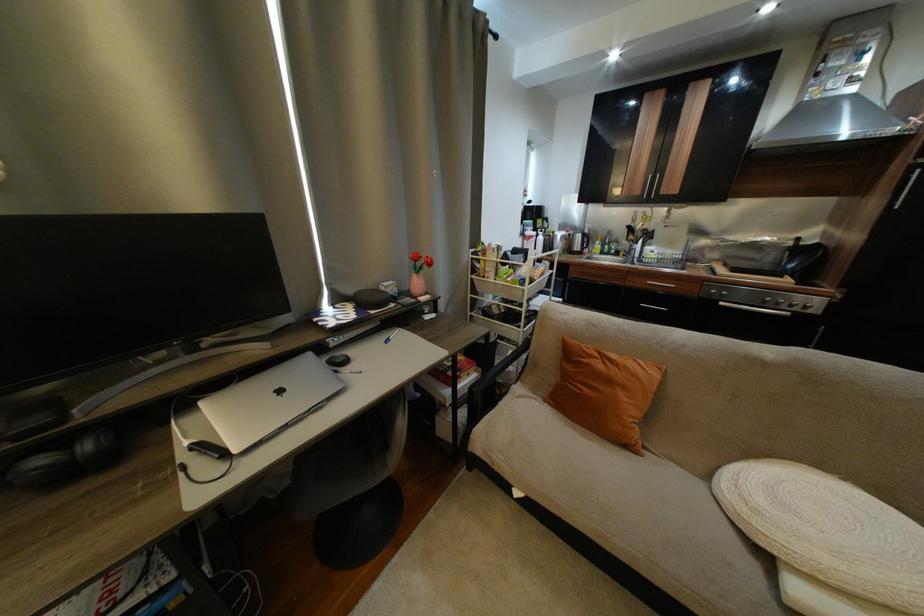
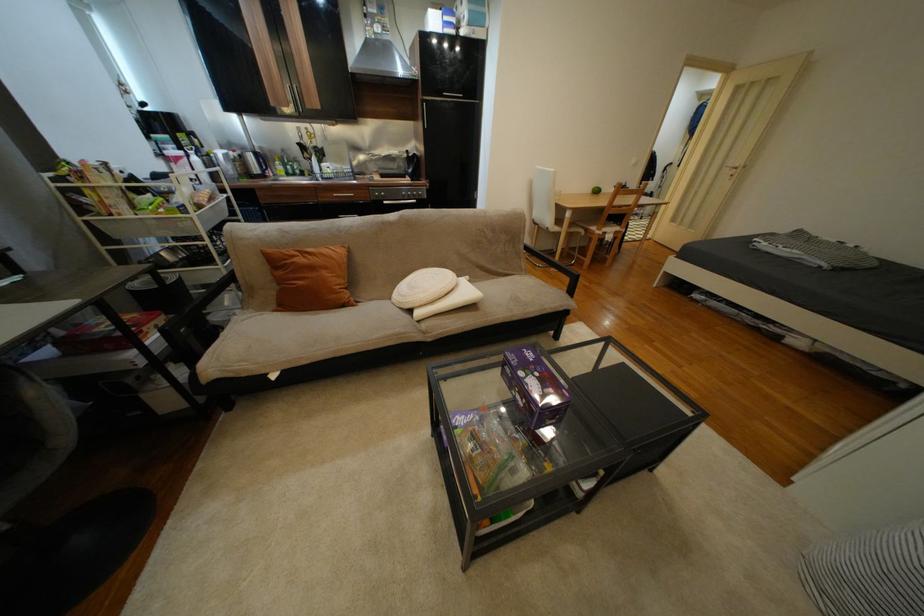
Where in the second image is the point corresponding to (x=862, y=191) from the first image?

(422, 118)